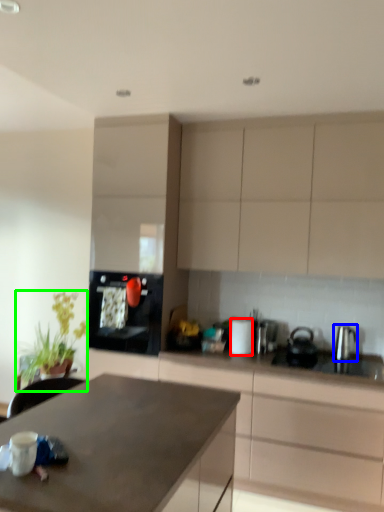
Question: Which is nearer to the appliance (highlighted by a red box)? kitchen appliance (highlighted by a blue box) or plant (highlighted by a green box).

Choices:
 (A) kitchen appliance
 (B) plant

Answer: (A)